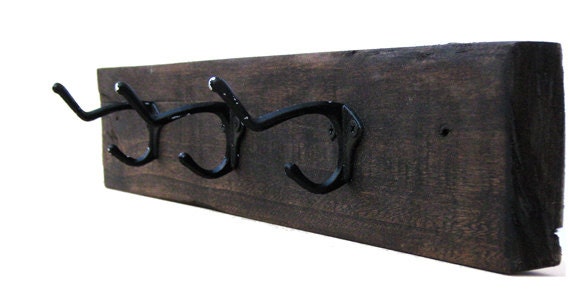
Locate an element on the screen. bottom hanger is located at coordinates (295, 175), (186, 160), (114, 150).